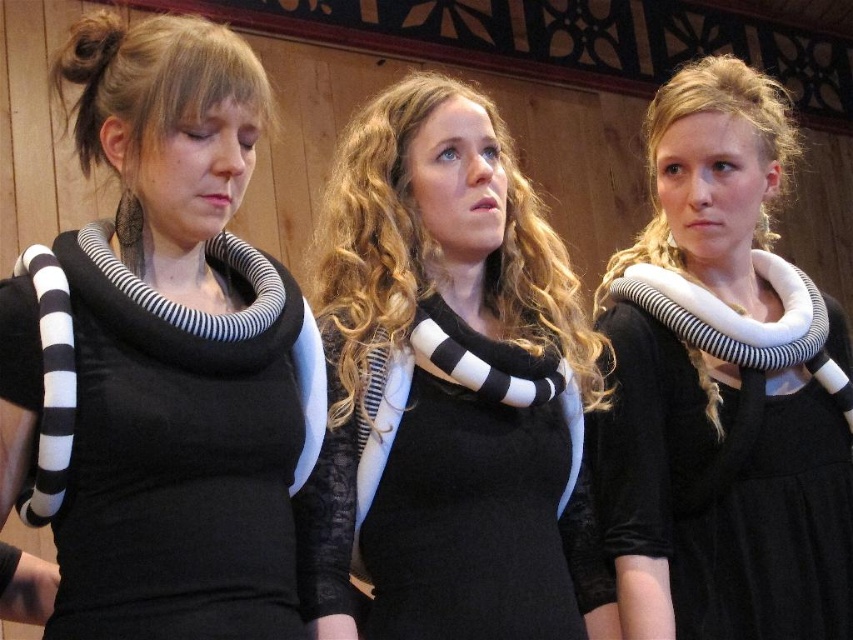
Question: Which object is the farthest from the black and white striped scarf at center?

Choices:
 (A) black matte scarf at left
 (B) white matte neckpiece at center

Answer: (B)

Question: Can you confirm if black and white striped scarf at center is wider than white matte neckpiece at center?

Choices:
 (A) yes
 (B) no

Answer: (A)

Question: Is the position of black matte scarf at left more distant than that of white matte neckpiece at center?

Choices:
 (A) no
 (B) yes

Answer: (A)

Question: Does black matte scarf at left have a greater width compared to white matte neckpiece at center?

Choices:
 (A) no
 (B) yes

Answer: (A)

Question: Which object is closer to the camera taking this photo?

Choices:
 (A) black matte scarf at left
 (B) black and white striped scarf at center

Answer: (A)

Question: Which object is positioned closest to the black matte scarf at left?

Choices:
 (A) black and white striped scarf at center
 (B) white matte neckpiece at center

Answer: (A)